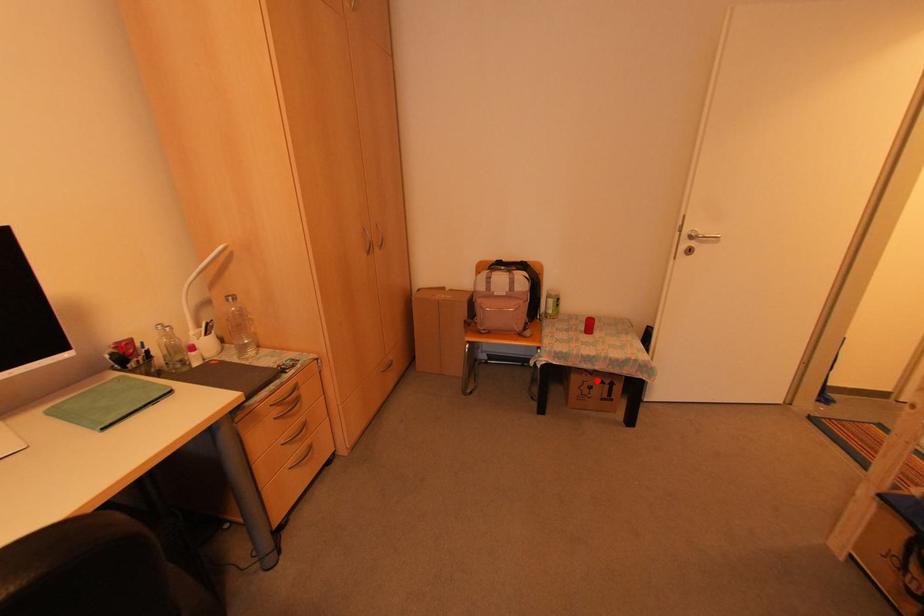
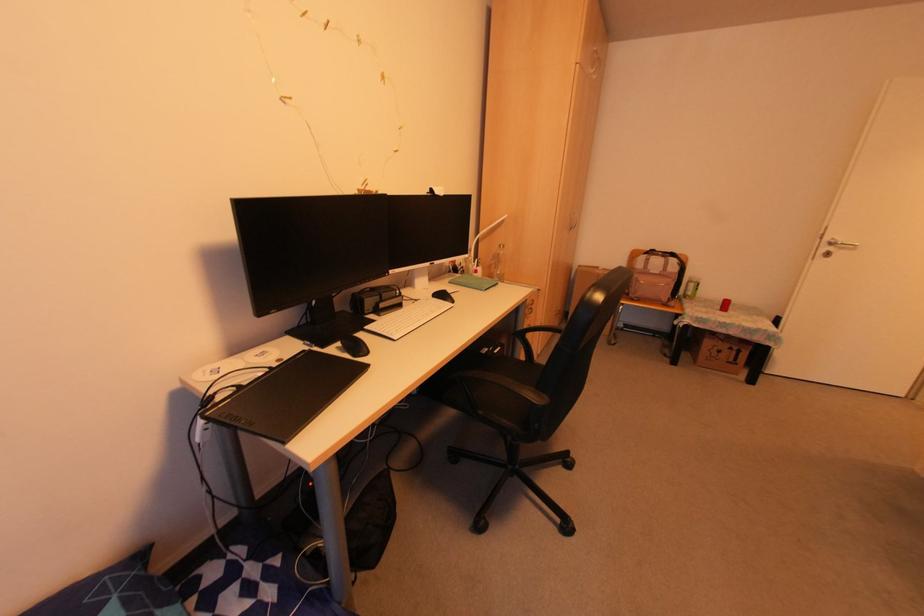
Where in the second image is the point corresponding to the highlighted location from the first image?

(725, 346)